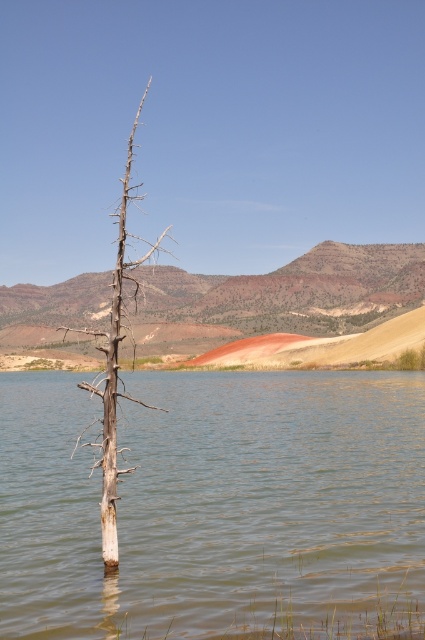
You are a kayaker planning to paddle through the brown matte water at center. You notice the dead wood tree at center nearby. Based on their widths, which one is narrower?

The brown matte water at center has a lesser width compared to the dead wood tree at center, so the brown matte water at center is narrower.

You are standing at the edge of the water in the serene landscape and see two points marked in the image. Which point, point (158, 529) or point (102, 406), is nearer to your current position?

Point (158, 529) is closer to the viewer than point (102, 406), so the point (158, 529) is nearer to your current position.